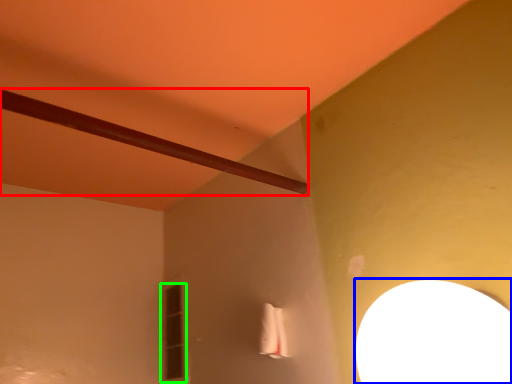
Question: Based on their relative distances, which object is nearer to beam (highlighted by a red box)? Choose from lamp (highlighted by a blue box) and window (highlighted by a green box).

Choices:
 (A) lamp
 (B) window

Answer: (A)